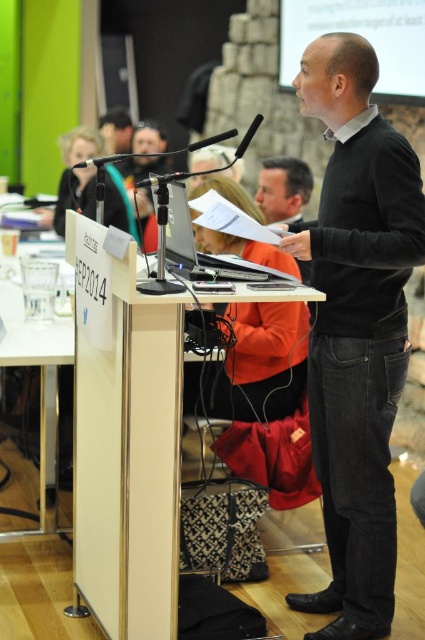
Question: Estimate the real-world distances between objects in this image. Which object is closer to the satin black laptop at center?

Choices:
 (A) black velvet sweater at center
 (B) black matte microphone at left
 (C) black plastic microphone at center

Answer: (C)

Question: Can you confirm if black velvet sweater at center is smaller than black matte microphone at left?

Choices:
 (A) no
 (B) yes

Answer: (A)

Question: Is black matte microphone at left smaller than black plastic microphone at center?

Choices:
 (A) no
 (B) yes

Answer: (A)

Question: Which object is closer to the camera taking this photo?

Choices:
 (A) black plastic microphone at center
 (B) black velvet sweater at center
 (C) satin black laptop at center
 (D) black matte microphone at left

Answer: (D)

Question: Can you confirm if black velvet sweater at center is positioned to the left of black matte microphone at left?

Choices:
 (A) yes
 (B) no

Answer: (B)

Question: Among these points, which one is farthest from the camera?

Choices:
 (A) (243, 134)
 (B) (161, 182)
 (C) (323, 436)
 (D) (118, 161)

Answer: (D)